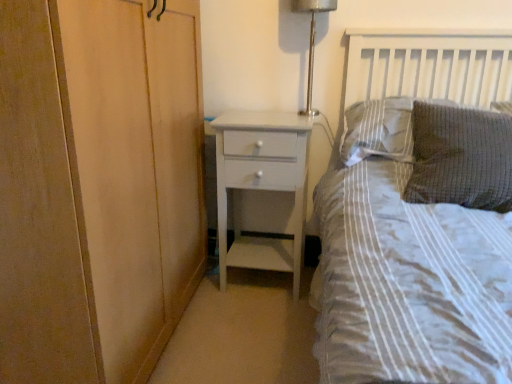
Question: From a real-world perspective, relative to metallic silver lamp at upper right, is gray textured pillow at upper right, marked as the 2th pillow in a front-to-back arrangement, vertically above or below?

Choices:
 (A) above
 (B) below

Answer: (B)

Question: Does point (394, 148) appear closer or farther from the camera than point (307, 104)?

Choices:
 (A) closer
 (B) farther

Answer: (A)

Question: Which is farther from the gray textured pillow at upper right, marked as the 2th pillow in a front-to-back arrangement?

Choices:
 (A) white painted wood chest of drawers at center
 (B) metallic silver lamp at upper right
 (C) textured gray pillow at upper right, which is the first pillow in front-to-back order

Answer: (A)

Question: Based on their relative distances, which object is nearer to the gray textured pillow at upper right, which is the first pillow from back to front?

Choices:
 (A) metallic silver lamp at upper right
 (B) white painted wood chest of drawers at center
 (C) textured gray pillow at upper right, the second pillow from the back

Answer: (C)